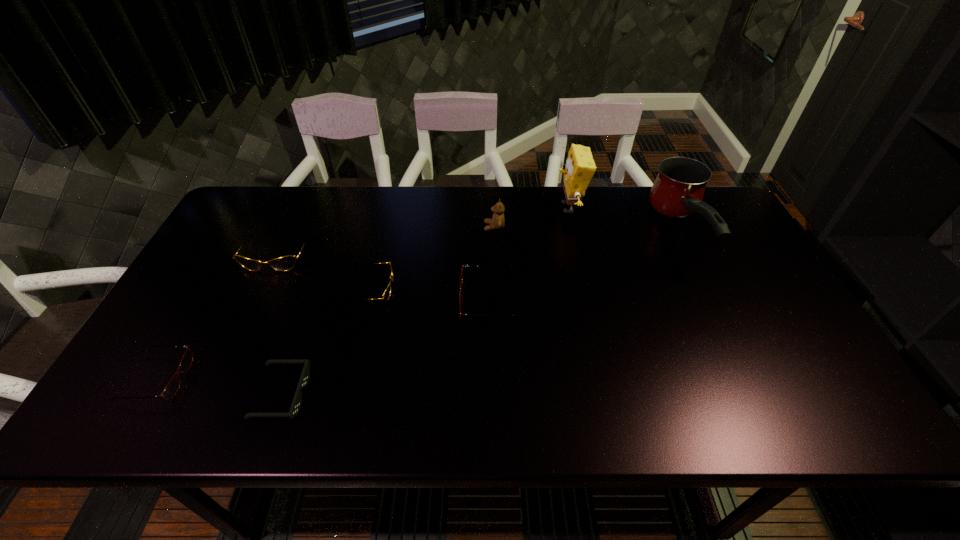
This screenshot has height=540, width=960. What are the coordinates of `vacant space located on the front-facing side of the teddy bear` in the screenshot? It's located at (404, 227).

This screenshot has height=540, width=960. I want to click on free point located 0.270m on the front-facing side of the bigger gold spectacles, so click(x=230, y=353).

The height and width of the screenshot is (540, 960). Identify the location of vacant space located 0.180m on the lenses of the bigger red spectacles. [x=392, y=301].

Where is `vacant space positioned 0.400m on the lenses of the bigger red spectacles`? Image resolution: width=960 pixels, height=540 pixels. vacant space positioned 0.400m on the lenses of the bigger red spectacles is located at coordinates (308, 301).

The height and width of the screenshot is (540, 960). In order to click on vacant space situated on the lenses of the bigger red spectacles in this screenshot , I will do `click(414, 301)`.

This screenshot has width=960, height=540. I want to click on free space located 0.260m on the front-facing side of the right gold spectacles, so click(x=489, y=288).

Identify the location of vacant space located 0.240m on the lenses of the left red spectacles. tap(291, 379).

You are a GUI agent. You are given a task and a screenshot of the screen. Output one action in this format:
    pyautogui.click(x=<x>, y=<y>)
    Task: Click on the free space located 0.070m on the front-facing side of the sunglasses
    The image size is (960, 540).
    Given the screenshot: What is the action you would take?
    pyautogui.click(x=336, y=394)

At what (x,y) coordinates should I click in order to perform the action: click on sponge located in the far edge section of the desktop. Please return your answer as a coordinate pair (x, y). Looking at the image, I should click on (580, 167).

Where is `saucepan present at the far edge`? saucepan present at the far edge is located at coordinates (x=678, y=190).